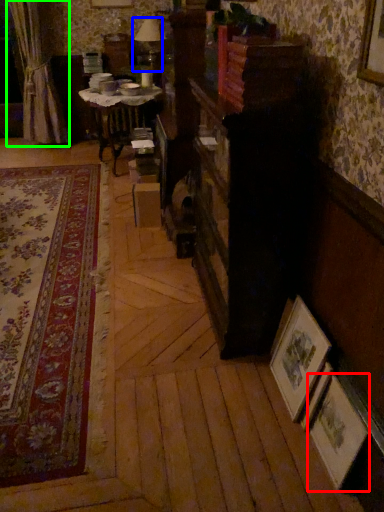
Question: Considering the real-world distances, which object is closest to picture frame (highlighted by a red box)? table lamp (highlighted by a blue box) or curtain (highlighted by a green box).

Choices:
 (A) table lamp
 (B) curtain

Answer: (A)